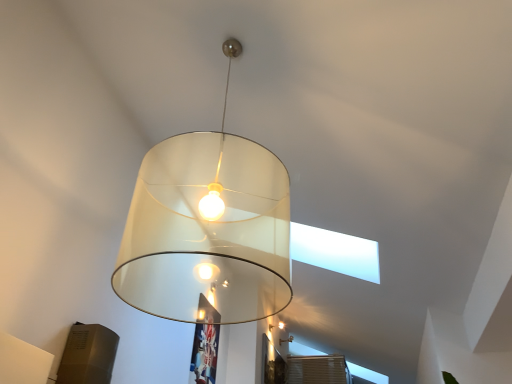
Question: In terms of size, does translucent white lampshade at center, the 1th lamp from the top, appear bigger or smaller than translucent glass lampshade at center, positioned as the 2th lamp in front-to-back order?

Choices:
 (A) small
 (B) big

Answer: (B)

Question: In terms of height, does translucent white lampshade at center, the 1th lamp from the left, look taller or shorter compared to translucent glass lampshade at center, which is the 1th lamp in back-to-front order?

Choices:
 (A) tall
 (B) short

Answer: (A)

Question: From a real-world perspective, is translucent white lampshade at center, the second lamp from the back, physically located above or below translucent glass lampshade at center, the first lamp from the right?

Choices:
 (A) above
 (B) below

Answer: (B)

Question: Is translucent glass lampshade at center, positioned as the 2th lamp in front-to-back order, wider or thinner than translucent white lampshade at center, the second lamp from the back?

Choices:
 (A) thin
 (B) wide

Answer: (A)

Question: Considering the relative positions of translucent glass lampshade at center, the first lamp from the right, and translucent white lampshade at center, the second lamp from the back, in the image provided, is translucent glass lampshade at center, the first lamp from the right, to the left or to the right of translucent white lampshade at center, the second lamp from the back,?

Choices:
 (A) right
 (B) left

Answer: (A)

Question: From a real-world perspective, is translucent glass lampshade at center, marked as the 2th lamp in a left-to-right arrangement, positioned above or below translucent white lampshade at center, the 1th lamp from the left?

Choices:
 (A) above
 (B) below

Answer: (A)

Question: Relative to translucent white lampshade at center, the 1th lamp from the left, is translucent glass lampshade at center, marked as the 2th lamp in a left-to-right arrangement, in front or behind?

Choices:
 (A) front
 (B) behind

Answer: (B)